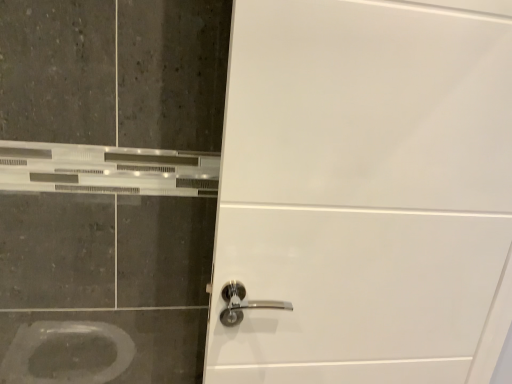
Question: Should I look upward or downward to see white glossy door handle at center?

Choices:
 (A) down
 (B) up

Answer: (A)